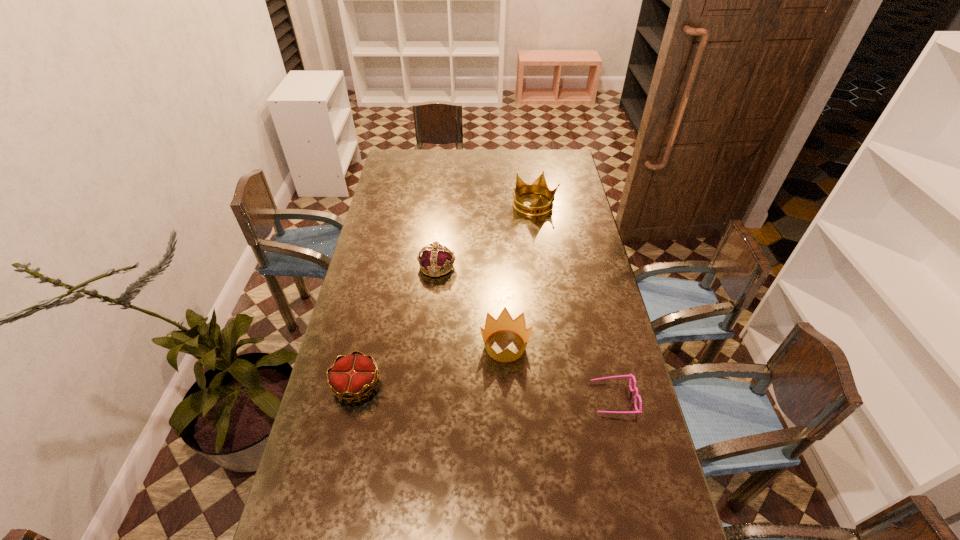
At what (x,y) coordinates should I click in order to perform the action: click on vacant space located on the arms of the spectacles. Please return your answer as a coordinate pair (x, y). The width and height of the screenshot is (960, 540). Looking at the image, I should click on (565, 398).

The width and height of the screenshot is (960, 540). In order to click on free space located 0.180m on the arms of the spectacles in this screenshot , I will do `click(532, 398)`.

Where is `object that is at the left edge`? object that is at the left edge is located at coordinates (351, 376).

Identify the location of crown located in the right edge section of the desktop. (539, 186).

Identify the location of spectacles that is positioned at the right edge. Image resolution: width=960 pixels, height=540 pixels. (637, 411).

Find the location of `free space at the far edge`. free space at the far edge is located at coordinates (523, 166).

In the image, there is a desktop. In order to click on vacant space at the left edge in this screenshot , I will do `click(369, 278)`.

This screenshot has width=960, height=540. In the image, there is a desktop. What are the coordinates of `vacant space at the right edge` in the screenshot? It's located at (566, 284).

Find the location of a particular element. This screenshot has height=540, width=960. free space at the far right corner of the desktop is located at coordinates (569, 156).

The width and height of the screenshot is (960, 540). I want to click on free point between the farthest crown and the fourth nearest object, so click(486, 235).